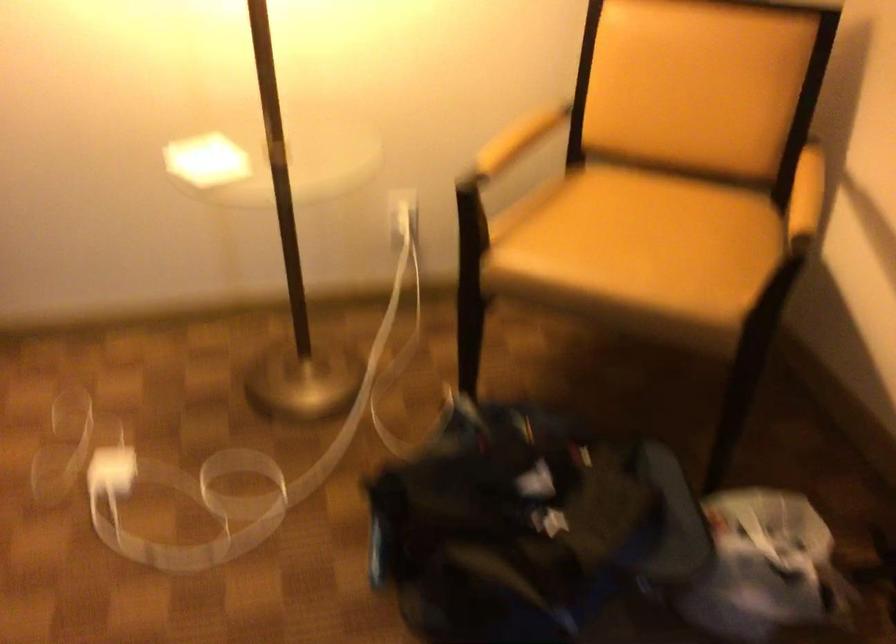
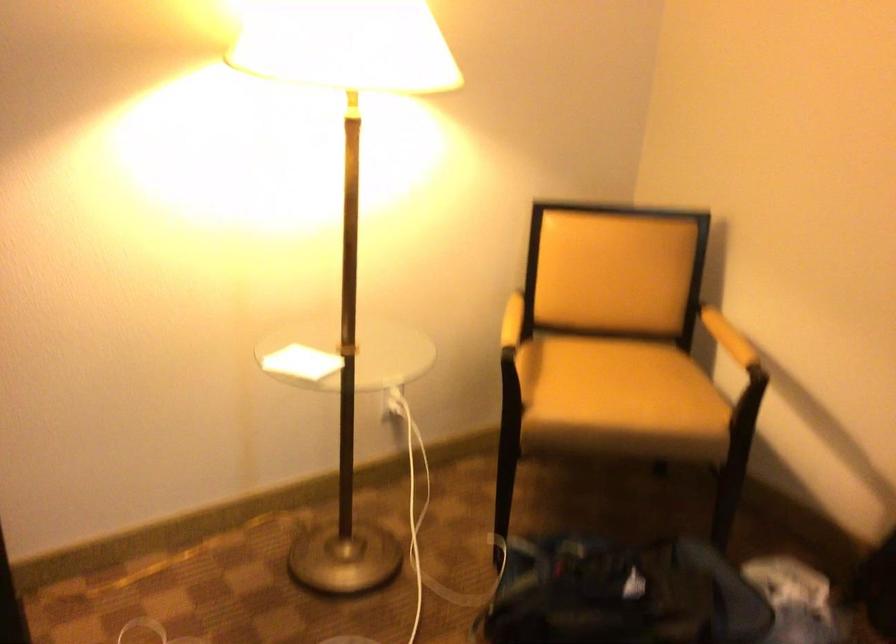
Find the pixel in the second image that matches point (626, 240) in the first image.

(618, 388)